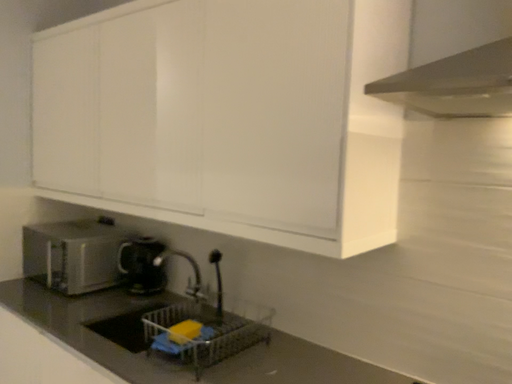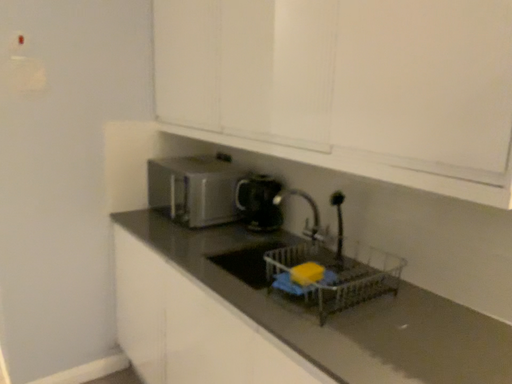
Question: How did the camera likely rotate when shooting the video?

Choices:
 (A) rotated left
 (B) rotated right

Answer: (A)